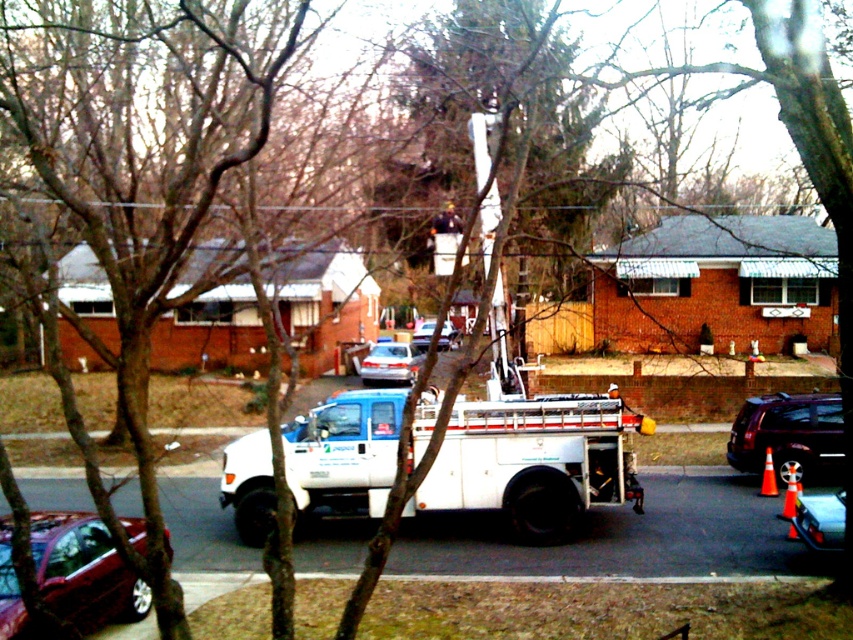
You are a delivery person trying to park your van between the shiny red sedan at lower left and the metallic silver car at lower right. Can you fit your van, which is 2.5 meters wide, in the space between them?

The shiny red sedan at lower left is wider than the metallic silver car at lower right. However, without knowing the exact distance between them, it is impossible to determine if the van can fit. Please check the available space between the two cars first.

You are a delivery driver who needs to park your van between the shiny red sedan at lower left and the metallic silver car at lower right. The van is 18 feet long. Can you park your van between them without overlapping either vehicle?

The distance between the shiny red sedan at lower left and the metallic silver car at lower right is 25.14 feet. Since the van is 18 feet long, there is enough space to park it between them without overlapping either vehicle.